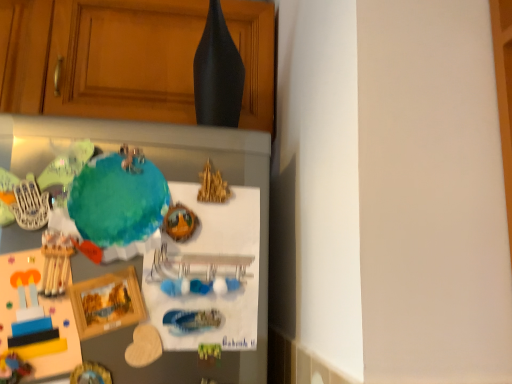
Question: Is teal matte globe at center taller than matte wood cabinet at upper center?

Choices:
 (A) no
 (B) yes

Answer: (A)

Question: Does teal matte globe at center have a smaller size compared to matte wood cabinet at upper center?

Choices:
 (A) yes
 (B) no

Answer: (A)

Question: From a real-world perspective, is teal matte globe at center on matte wood cabinet at upper center?

Choices:
 (A) yes
 (B) no

Answer: (B)

Question: Considering the relative positions of teal matte globe at center and matte wood cabinet at upper center in the image provided, is teal matte globe at center to the left of matte wood cabinet at upper center from the viewer's perspective?

Choices:
 (A) no
 (B) yes

Answer: (A)

Question: Can you confirm if teal matte globe at center is shorter than matte wood cabinet at upper center?

Choices:
 (A) no
 (B) yes

Answer: (B)

Question: Is matte wood cabinet at upper center a part of teal matte globe at center?

Choices:
 (A) yes
 (B) no

Answer: (B)

Question: Is matte wood cabinet at upper center in contact with teal matte globe at center?

Choices:
 (A) no
 (B) yes

Answer: (A)

Question: Considering the relative positions of matte wood cabinet at upper center and teal matte globe at center in the image provided, is matte wood cabinet at upper center to the right of teal matte globe at center from the viewer's perspective?

Choices:
 (A) yes
 (B) no

Answer: (B)

Question: Considering the relative sizes of matte wood cabinet at upper center and teal matte globe at center in the image provided, is matte wood cabinet at upper center bigger than teal matte globe at center?

Choices:
 (A) yes
 (B) no

Answer: (A)

Question: Considering the relative positions of matte wood cabinet at upper center and teal matte globe at center in the image provided, is matte wood cabinet at upper center behind teal matte globe at center?

Choices:
 (A) yes
 (B) no

Answer: (A)

Question: Considering the relative positions of matte wood cabinet at upper center and teal matte globe at center in the image provided, is matte wood cabinet at upper center to the left of teal matte globe at center from the viewer's perspective?

Choices:
 (A) yes
 (B) no

Answer: (A)

Question: From the image's perspective, is matte wood cabinet at upper center over teal matte globe at center?

Choices:
 (A) yes
 (B) no

Answer: (A)

Question: Is matte wood cabinet at upper center wider or thinner than teal matte globe at center?

Choices:
 (A) wide
 (B) thin

Answer: (A)